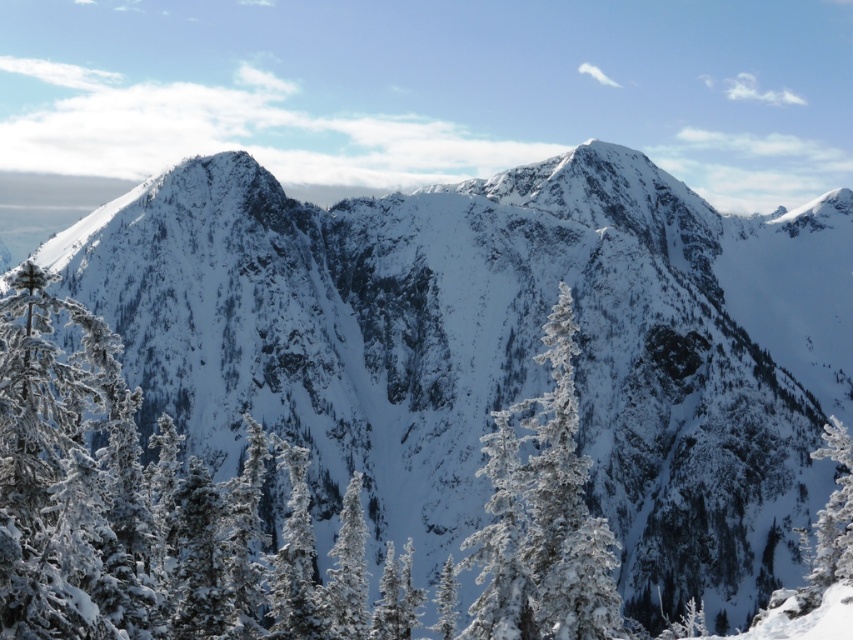
Question: Is white frosty tree at center to the left of white frosty tree at lower right from the viewer's perspective?

Choices:
 (A) no
 (B) yes

Answer: (B)

Question: Can you confirm if white frosty tree at center is smaller than white frosty tree at lower right?

Choices:
 (A) no
 (B) yes

Answer: (A)

Question: Which point is farther to the camera?

Choices:
 (A) (824, 506)
 (B) (500, 522)

Answer: (A)

Question: Among these objects, which one is nearest to the camera?

Choices:
 (A) white frosty tree at center
 (B) white frosty tree at lower right

Answer: (A)

Question: Is white frosty tree at center smaller than white frosty tree at lower right?

Choices:
 (A) no
 (B) yes

Answer: (A)

Question: Which object appears closest to the camera in this image?

Choices:
 (A) white frosty tree at center
 (B) white frosty tree at lower right

Answer: (A)